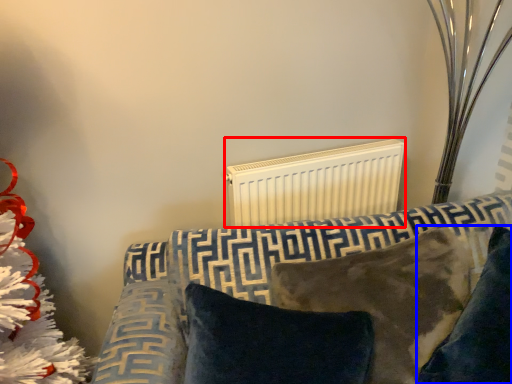
Question: Among these objects, which one is farthest to the camera, radiator (highlighted by a red box) or pillow (highlighted by a blue box)?

Choices:
 (A) radiator
 (B) pillow

Answer: (A)